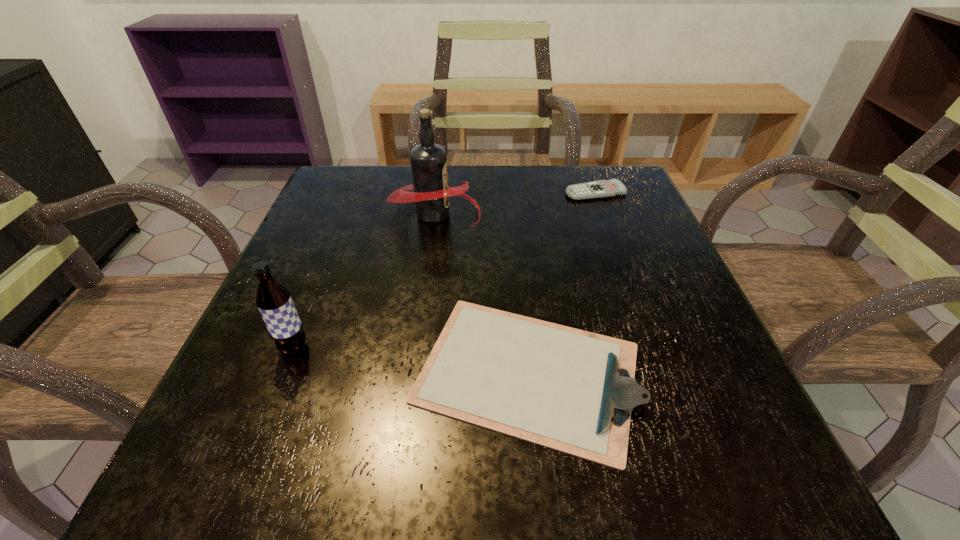
At what (x,y) coordinates should I click in order to perform the action: click on vacant space at the left edge of the desktop. Please return your answer as a coordinate pair (x, y). This screenshot has height=540, width=960. Looking at the image, I should click on (349, 245).

This screenshot has height=540, width=960. What are the coordinates of `vacant region at the right edge of the desktop` in the screenshot? It's located at (726, 408).

The image size is (960, 540). What are the coordinates of `blank space at the far left corner of the desktop` in the screenshot? It's located at (391, 181).

Locate an element on the screen. The height and width of the screenshot is (540, 960). free space at the near left corner of the desktop is located at coordinates (231, 436).

I want to click on free space at the near right corner of the desktop, so click(x=762, y=452).

Locate an element on the screen. This screenshot has width=960, height=540. vacant space that is in between the clipboard and the left root beer is located at coordinates (411, 360).

I want to click on free space that is in between the shortest object and the second shortest object, so click(562, 282).

This screenshot has width=960, height=540. What are the coordinates of `vacant region between the left root beer and the remote control` in the screenshot? It's located at (444, 271).

Where is `free spot between the remote control and the right root beer`? The image size is (960, 540). free spot between the remote control and the right root beer is located at coordinates (515, 203).

Identify the location of vacant space that is in between the clipboard and the nearer root beer. (411, 360).